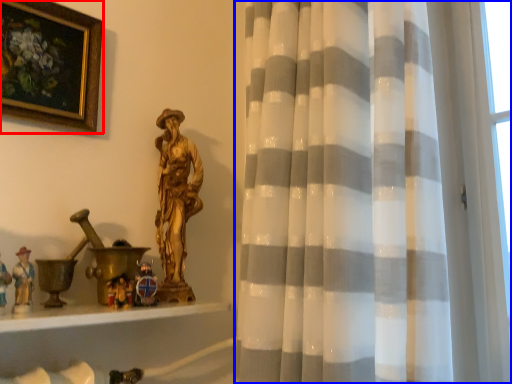
Question: Which point is further to the camera, picture frame (highlighted by a red box) or curtain (highlighted by a blue box)?

Choices:
 (A) picture frame
 (B) curtain

Answer: (A)